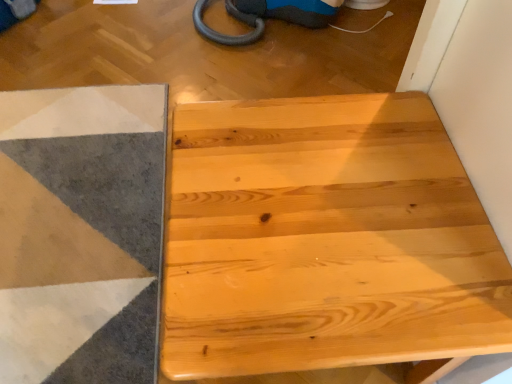
At what (x,y) coordinates should I click in order to perform the action: click on blank area to the left of natural wood table at center. Please return your answer as a coordinate pair (x, y). Looking at the image, I should click on (98, 266).